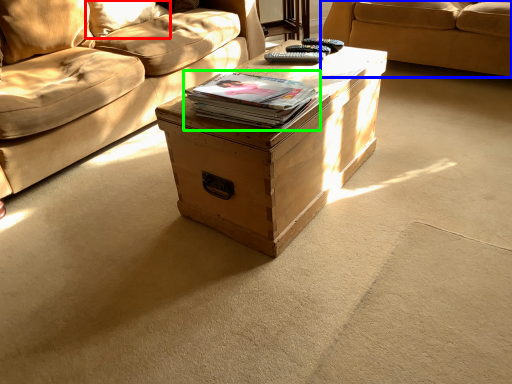
Question: Estimate the real-world distances between objects in this image. Which object is closer to pillow (highlighted by a red box), studio couch (highlighted by a blue box) or paperback book (highlighted by a green box)?

Choices:
 (A) studio couch
 (B) paperback book

Answer: (B)